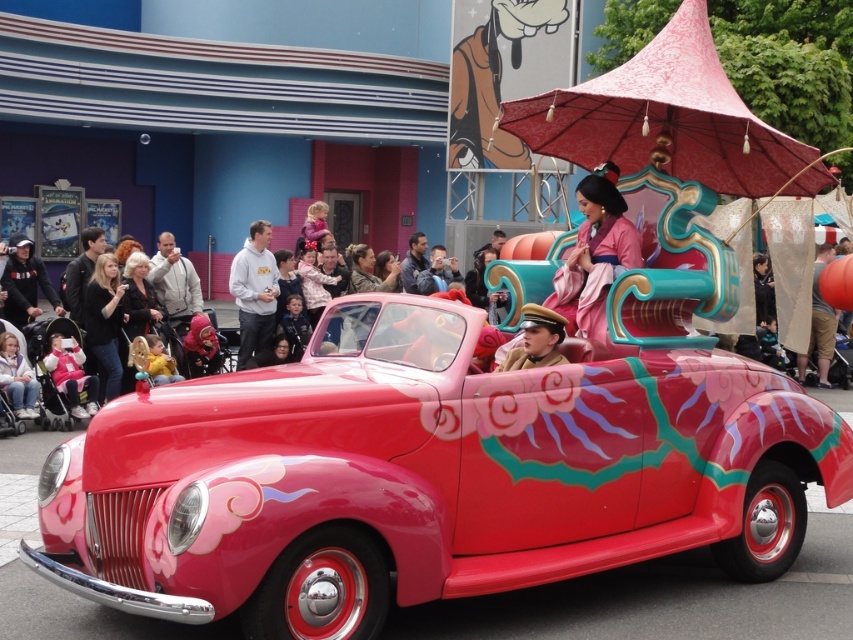
You are a photographer trying to capture the black leather jacket at left and the matte gold helmet at center in the same frame. Based on their sizes, which object should you focus on first to ensure both are in the shot?

The black leather jacket at left has a lesser width compared to matte gold helmet at center, so you should focus on the matte gold helmet at center first to ensure both objects fit in the frame.

You are a photographer at the parade and want to capture both the pink satin kimono at upper center and the pink fabric stroller at lower left in the same frame. Which object should you focus on first to ensure both are in focus?

You should focus on the pink satin kimono at upper center first because it is closer to the viewer than the pink fabric stroller at lower left, ensuring both will be in focus when using depth of field.

You are a photographer trying to capture both the black leather jacket at left and the matte gold helmet at center in a single shot. Which object should you focus on first to ensure both are in frame?

The black leather jacket at left is bigger than the matte gold helmet at center, so you should focus on the matte gold helmet at center first to ensure both fit within the frame.